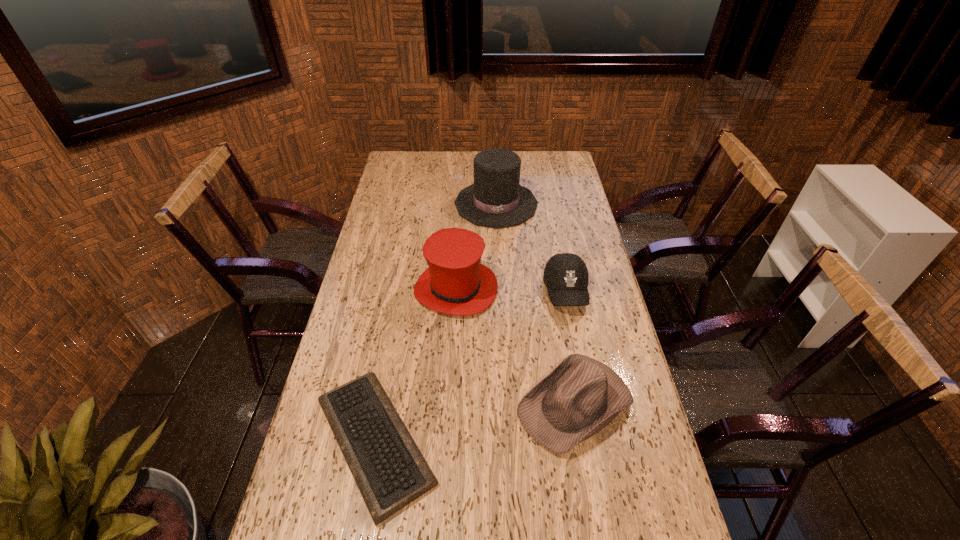
Identify the location of unoccupied position between the farther hat and the shortest object. (436, 323).

Where is `the second closest object to the farther hat`? the second closest object to the farther hat is located at coordinates (566, 277).

Find the location of a particular element. This screenshot has height=540, width=960. object that stands as the fourth closest to the farther hat is located at coordinates (390, 472).

Locate an element on the screen. blank area in the image that satisfies the following two spatial constraints: 1. on the front of the farther hat with the decoration; 2. on the left side of the fedora is located at coordinates (505, 404).